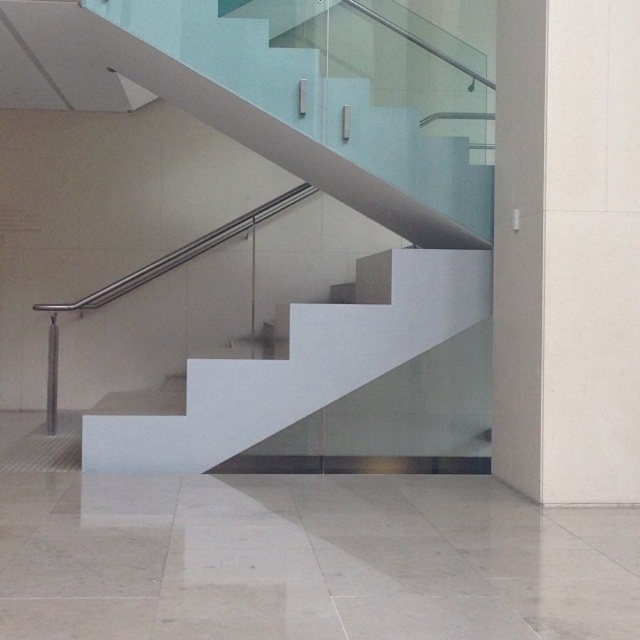
You are standing at the entrance of the staircase area and want to locate the white glossy stairs at center. According to the coordinates provided, where should you look to find them?

The white glossy stairs at center are located at coordinates point (321, 198).

You are standing at the bottom of the white glossy stairs at center and want to reach the white smooth pillar at right. Can you walk directly to it without climbing the stairs?

The white glossy stairs at center is located above the white smooth pillar at right, so you cannot walk directly to the white smooth pillar at right without climbing the stairs.

You are an interior designer planning to place a 1.2 meter wide sofa in the living room. You see the white glossy stairs at center and the white smooth pillar at right. Based on their widths, which object can the sofa be placed next to without blocking the staircase entrance?

The white glossy stairs at center might be wider than the white smooth pillar at right, so the sofa should be placed next to the white smooth pillar at right to avoid blocking the staircase entrance.